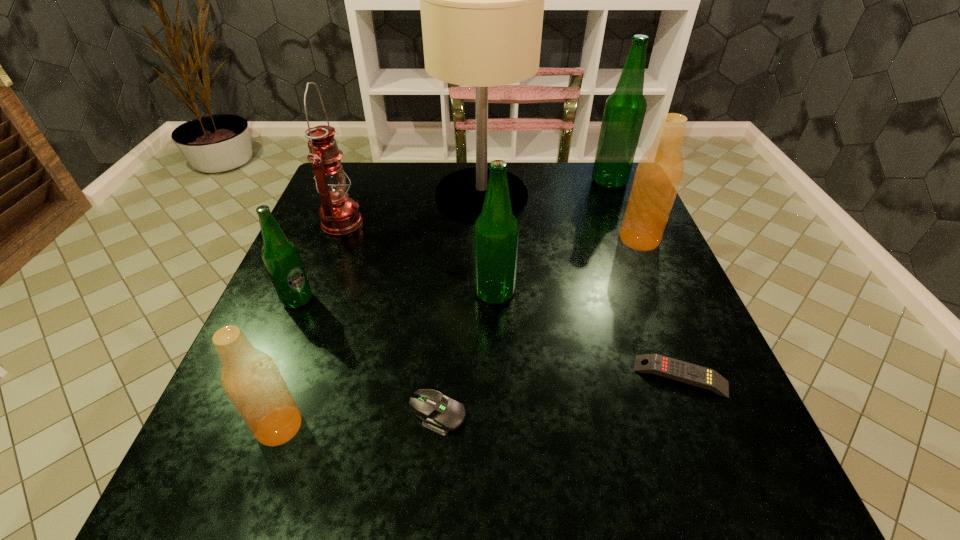
In order to click on beige table lamp in this screenshot , I will do (482, 0).

This screenshot has height=540, width=960. In order to click on the tallest object in this screenshot , I will do `click(482, 0)`.

Locate an element on the screen. The height and width of the screenshot is (540, 960). the farthest beer bottle is located at coordinates (624, 112).

At what (x,y) coordinates should I click in order to perform the action: click on the farthest green beer bottle. Please return your answer as a coordinate pair (x, y). The width and height of the screenshot is (960, 540). Looking at the image, I should click on (624, 112).

Identify the location of red oil lamp. (339, 214).

At what (x,y) coordinates should I click in order to perform the action: click on the bigger tan beer bottle. Please return your answer as a coordinate pair (x, y). Looking at the image, I should click on (658, 175).

Identify the location of the second farthest beer bottle. (658, 175).

Identify the location of the second green beer bottle from right to left. (496, 231).

Locate an element on the screen. The height and width of the screenshot is (540, 960). the third beer bottle from left to right is located at coordinates (496, 231).

Where is `the leftmost green beer bottle`? The width and height of the screenshot is (960, 540). the leftmost green beer bottle is located at coordinates (280, 255).